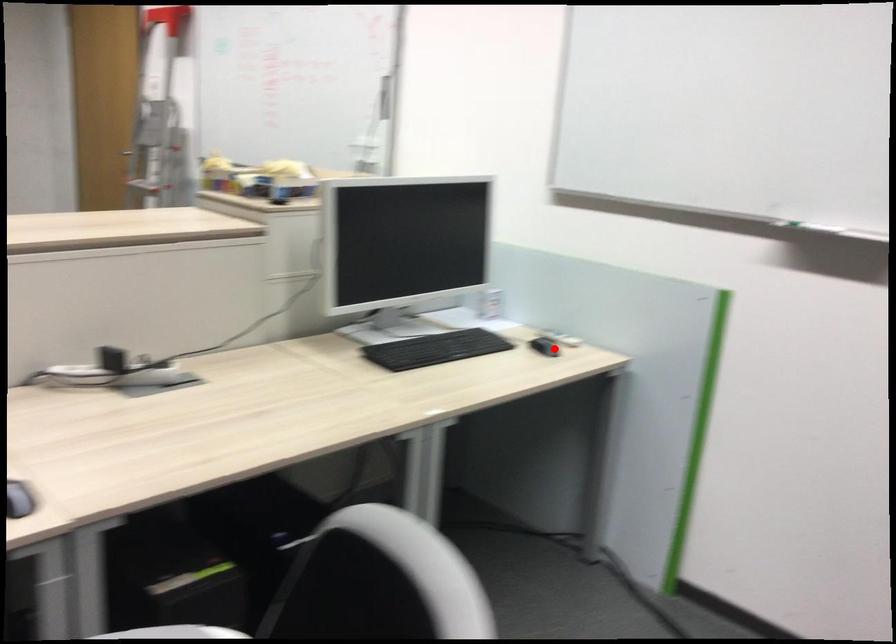
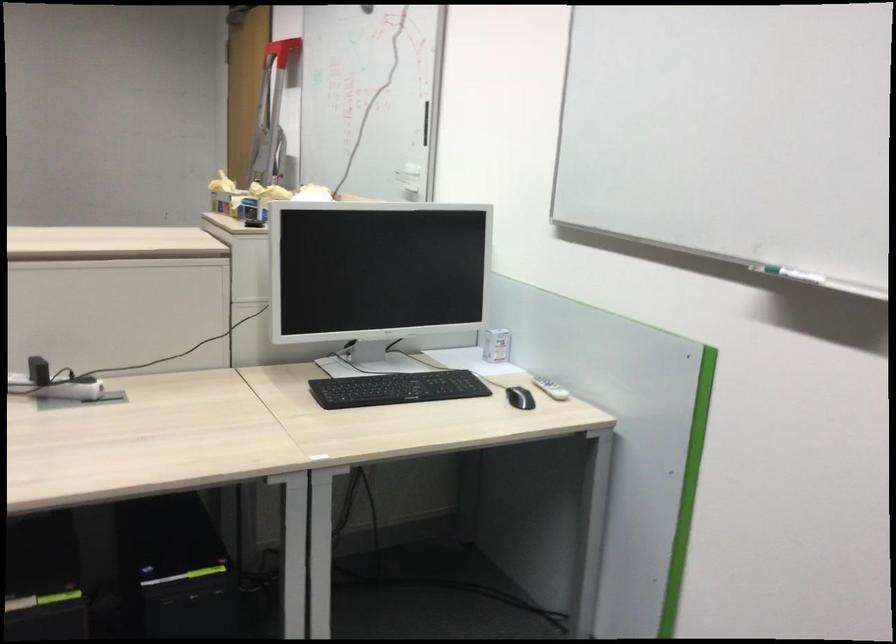
The point at the highlighted location is marked in the first image. Where is the corresponding point in the second image?

(520, 398)